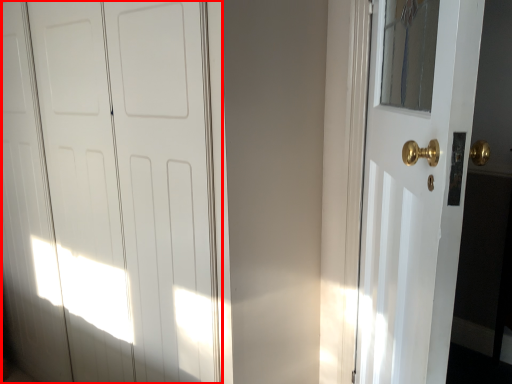
Question: Where is door (annotated by the red box) located in relation to door in the image?

Choices:
 (A) left
 (B) right

Answer: (A)